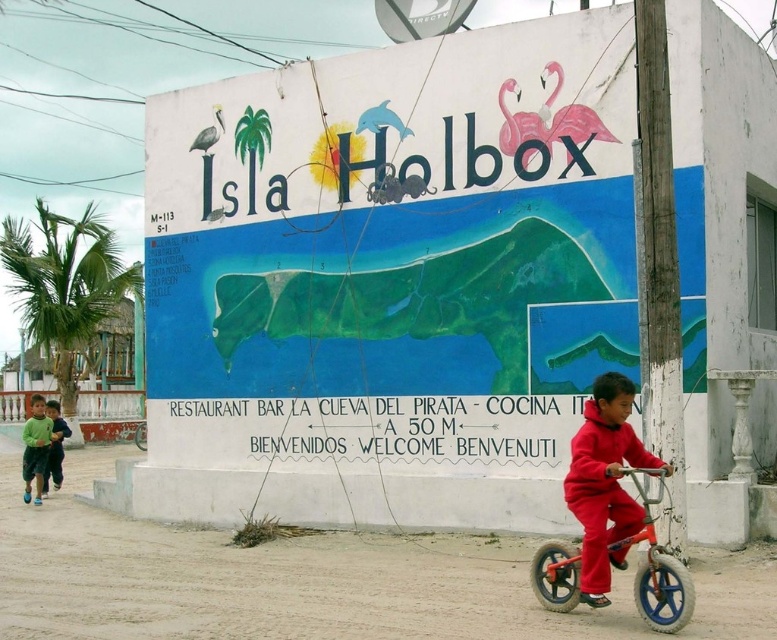
Question: Is green fleece jacket at lower left positioned behind green cotton shirt at left?

Choices:
 (A) yes
 (B) no

Answer: (B)

Question: Among these points, which one is farthest from the camera?

Choices:
 (A) (25, 468)
 (B) (618, 461)
 (C) (678, 568)

Answer: (A)

Question: Among these objects, which one is nearest to the camera?

Choices:
 (A) orange matte bicycle at lower left
 (B) orange matte monocycle at lower right

Answer: (B)

Question: Does green fleece jacket at lower left have a lesser width compared to green cotton shirt at left?

Choices:
 (A) yes
 (B) no

Answer: (A)

Question: Does orange matte monocycle at lower right appear on the left side of green cotton shirt at left?

Choices:
 (A) no
 (B) yes

Answer: (A)

Question: Which object is farther from the camera taking this photo?

Choices:
 (A) red fleece suit at lower right
 (B) orange matte bicycle at lower left

Answer: (B)